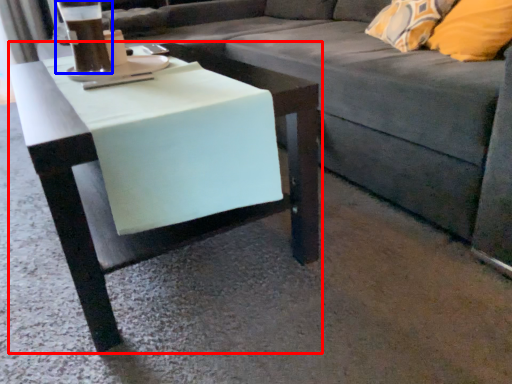
Question: Among these objects, which one is farthest to the camera, table (highlighted by a red box) or beverage (highlighted by a blue box)?

Choices:
 (A) table
 (B) beverage

Answer: (B)